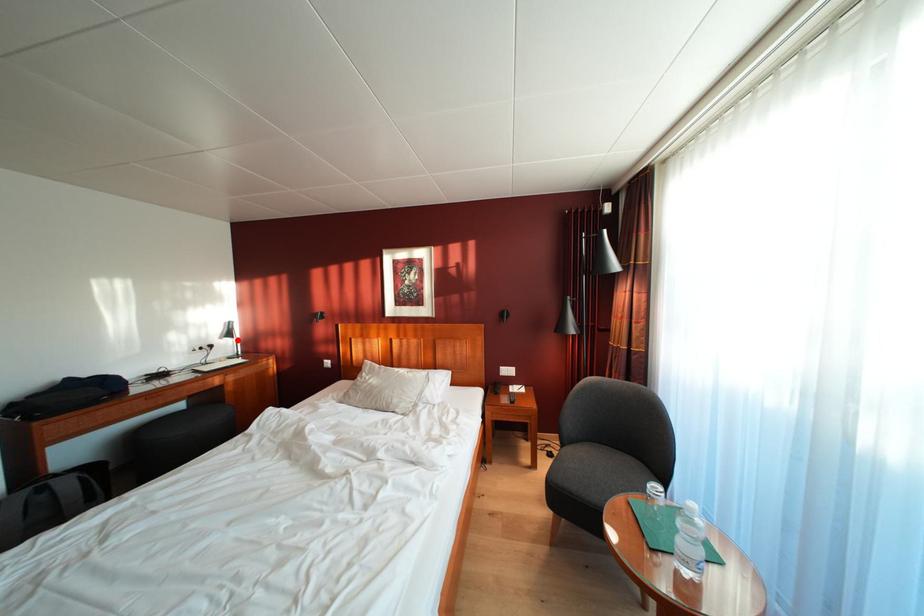
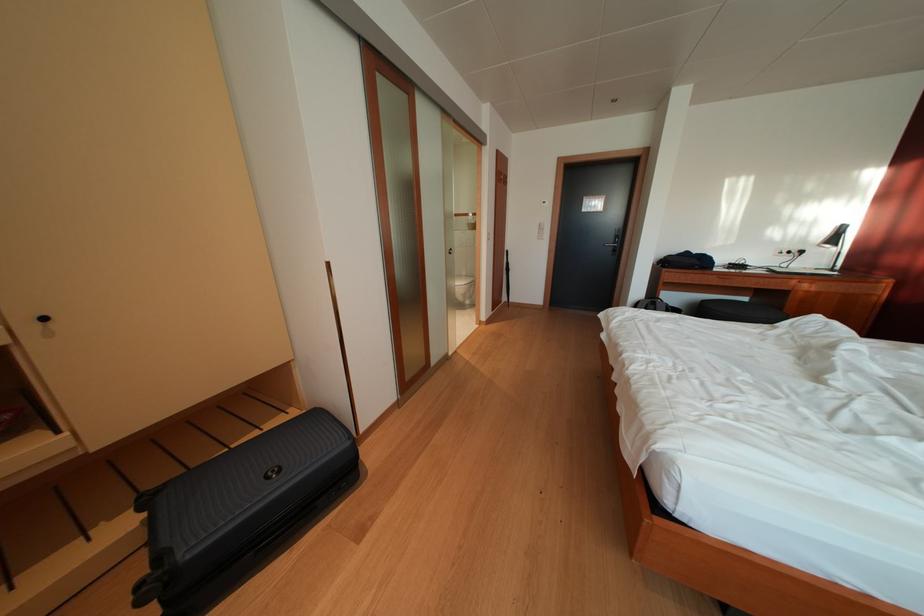
Question: I am providing you with two images of the same scene from different viewpoints. Given a red point in image1, look at the same physical point in image2. Is it:

Choices:
 (A) Closer to the viewpoint
 (B) Farther from the viewpoint

Answer: (B)